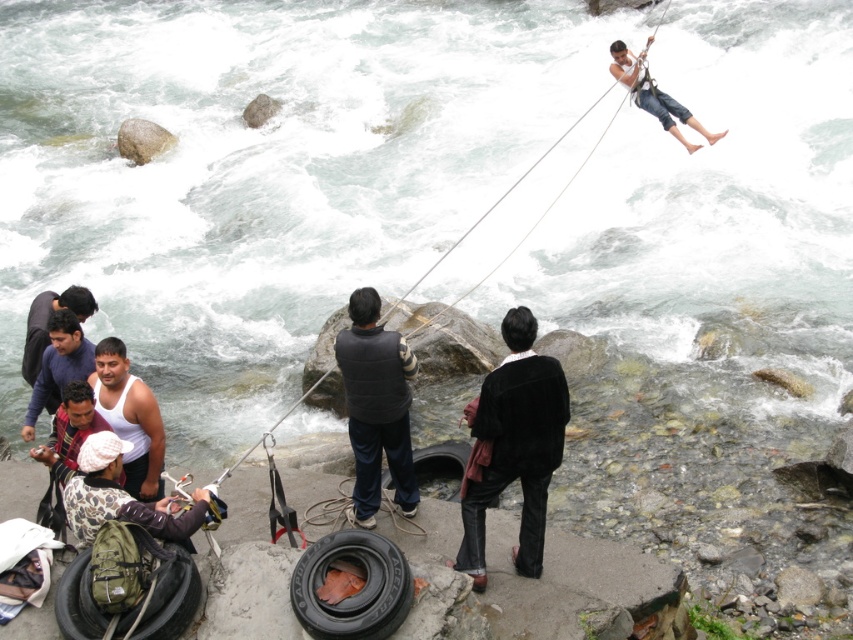
Question: Is white matte tank top at lower left bigger than smooth gray rock at upper left?

Choices:
 (A) no
 (B) yes

Answer: (A)

Question: Which point is closer to the camera taking this photo?

Choices:
 (A) (50, 349)
 (B) (310, 624)
 (C) (480, 518)

Answer: (B)

Question: Which object is positioned farthest from the smooth gray rock at upper left?

Choices:
 (A) white matte tank top at lower left
 (B) leopard print jacket at lower left

Answer: (B)

Question: Which point is closer to the camera?

Choices:
 (A) black rubber tire at lower left
 (B) leopard print jacket at lower left

Answer: (A)

Question: Can you confirm if black fleece vest at center is positioned below leopard print jacket at lower left?

Choices:
 (A) no
 (B) yes

Answer: (A)

Question: Can you confirm if black suede jacket at center is smaller than smooth gray rock at upper left?

Choices:
 (A) yes
 (B) no

Answer: (B)